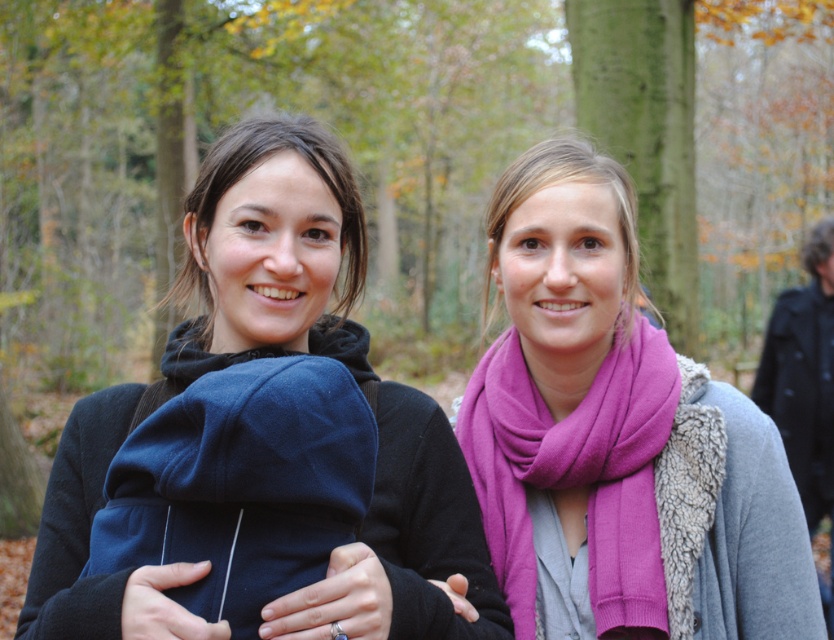
Question: Considering the relative positions of purple scarf at center and matte black jacket at left in the image provided, where is purple scarf at center located with respect to matte black jacket at left?

Choices:
 (A) below
 (B) above

Answer: (A)

Question: Does purple scarf at center lie behind matte black jacket at left?

Choices:
 (A) yes
 (B) no

Answer: (A)

Question: Which point appears farthest from the camera in this image?

Choices:
 (A) (157, 608)
 (B) (672, 532)

Answer: (B)

Question: Which of the following is the farthest from the observer?

Choices:
 (A) (516, 596)
 (B) (471, 509)
 (C) (526, 157)

Answer: (C)

Question: Does purple scarf at center appear over matte black jacket at left?

Choices:
 (A) no
 (B) yes

Answer: (A)

Question: Which point is closer to the camera?

Choices:
 (A) purple woolen scarf at center
 (B) purple scarf at center
 (C) matte black jacket at left

Answer: (C)